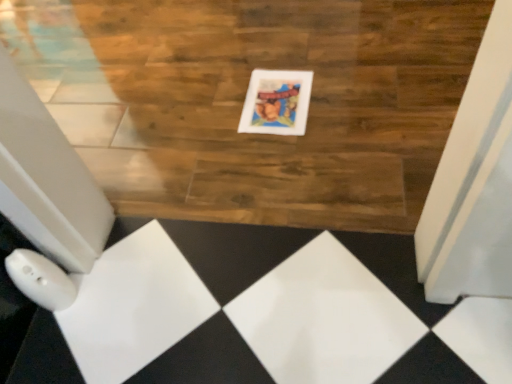
Question: In terms of width, does wooden floor at center look wider or thinner when compared to white glossy picture frame at center?

Choices:
 (A) thin
 (B) wide

Answer: (B)

Question: Which is correct: wooden floor at center is inside white glossy picture frame at center, or outside of it?

Choices:
 (A) outside
 (B) inside

Answer: (A)

Question: Is point (386, 51) positioned closer to the camera than point (301, 122)?

Choices:
 (A) closer
 (B) farther

Answer: (B)

Question: Considering the positions of white glossy picture frame at center and wooden floor at center in the image, is white glossy picture frame at center taller or shorter than wooden floor at center?

Choices:
 (A) short
 (B) tall

Answer: (A)

Question: Based on their sizes in the image, would you say white glossy picture frame at center is bigger or smaller than wooden floor at center?

Choices:
 (A) big
 (B) small

Answer: (B)

Question: Is point (298, 112) positioned closer to the camera than point (160, 190)?

Choices:
 (A) closer
 (B) farther

Answer: (B)

Question: Looking at their shapes, would you say white glossy picture frame at center is wider or thinner than wooden floor at center?

Choices:
 (A) thin
 (B) wide

Answer: (A)